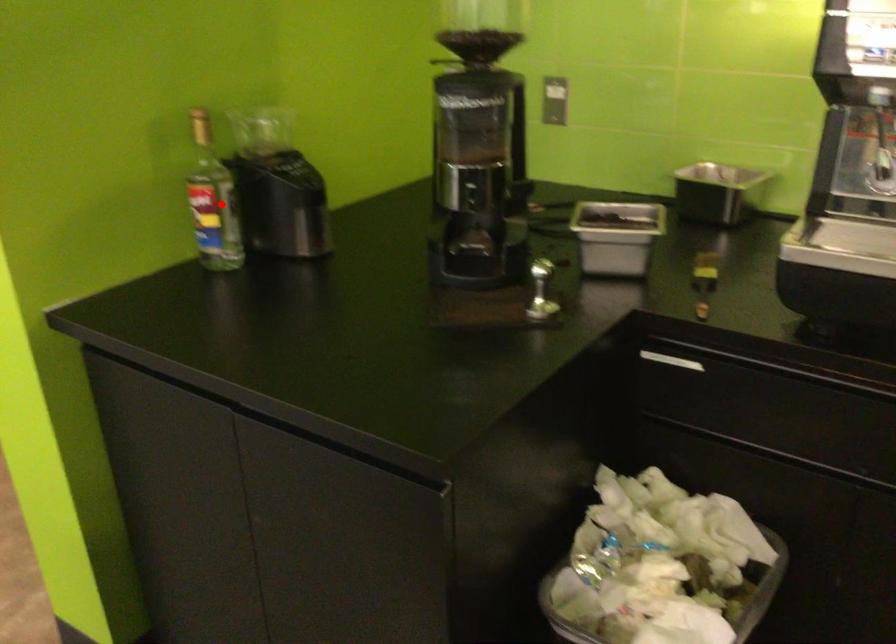
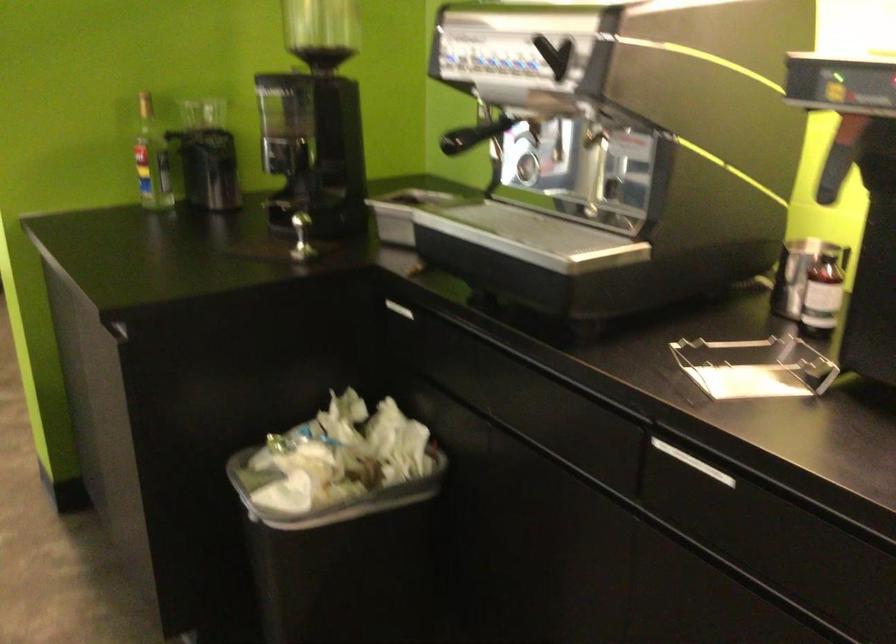
Find the pixel in the second image that matches the highlighted location in the first image.

(151, 158)